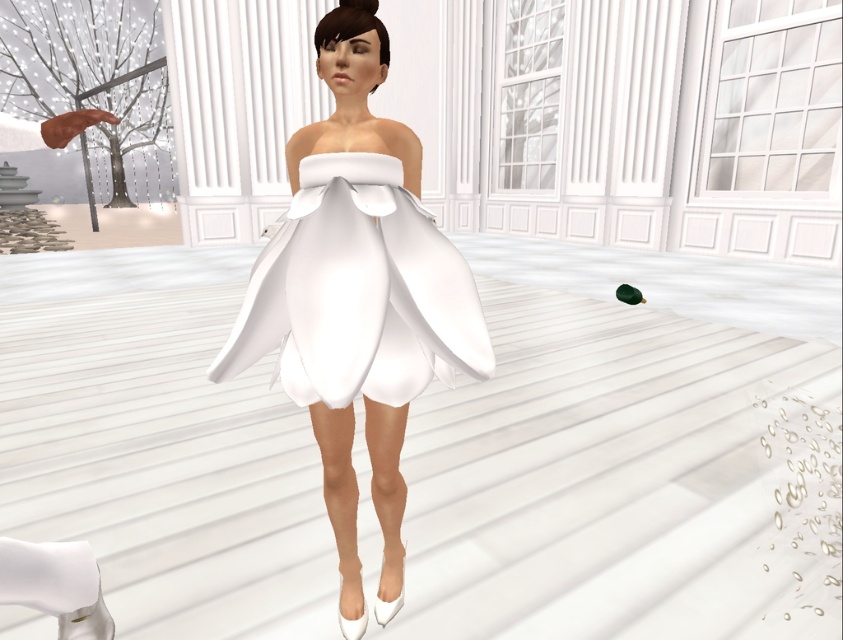
Is white satin dress at center in front of satin white dress at center?

No, it is behind satin white dress at center.

Which is above, white satin dress at center or satin white dress at center?

satin white dress at center

I want to click on white satin dress at center, so click(358, 298).

Locate an element on the screen. white satin dress at center is located at coordinates (358, 298).